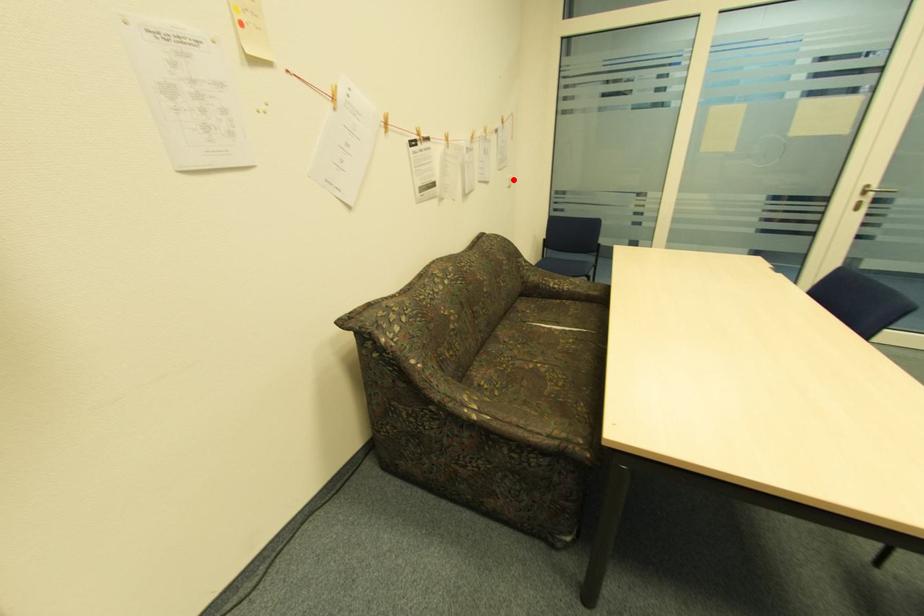
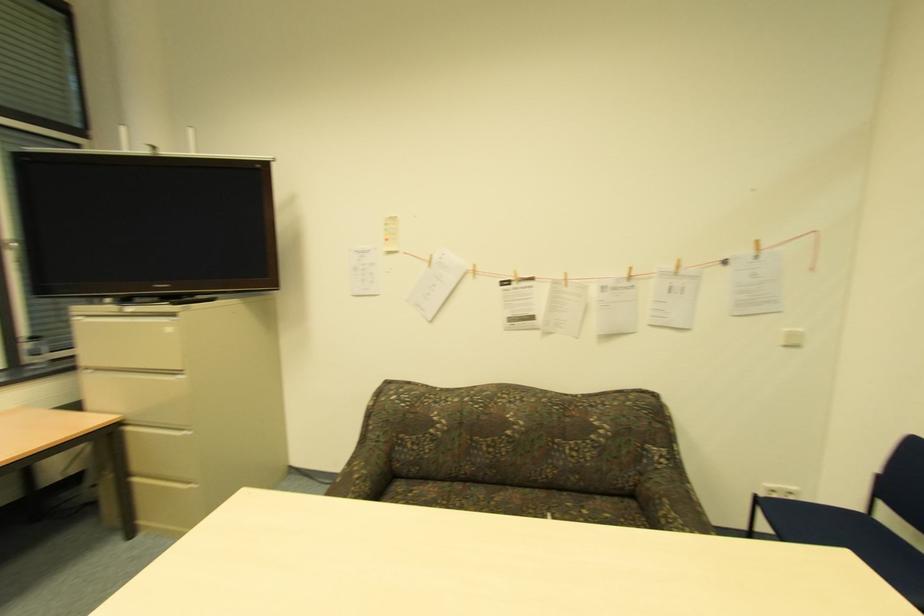
Locate, in the second image, the point that corresponds to the highlighted location in the first image.

(792, 334)